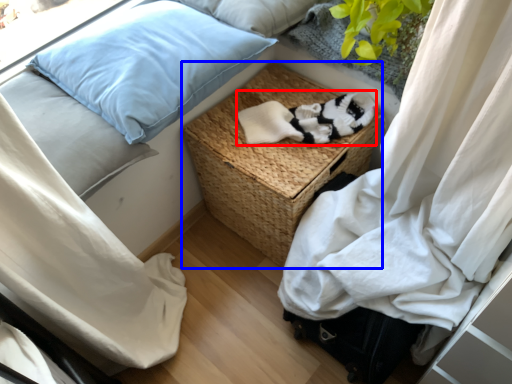
Question: Which object is closer to the camera taking this photo, clothing (highlighted by a red box) or furniture (highlighted by a blue box)?

Choices:
 (A) clothing
 (B) furniture

Answer: (B)